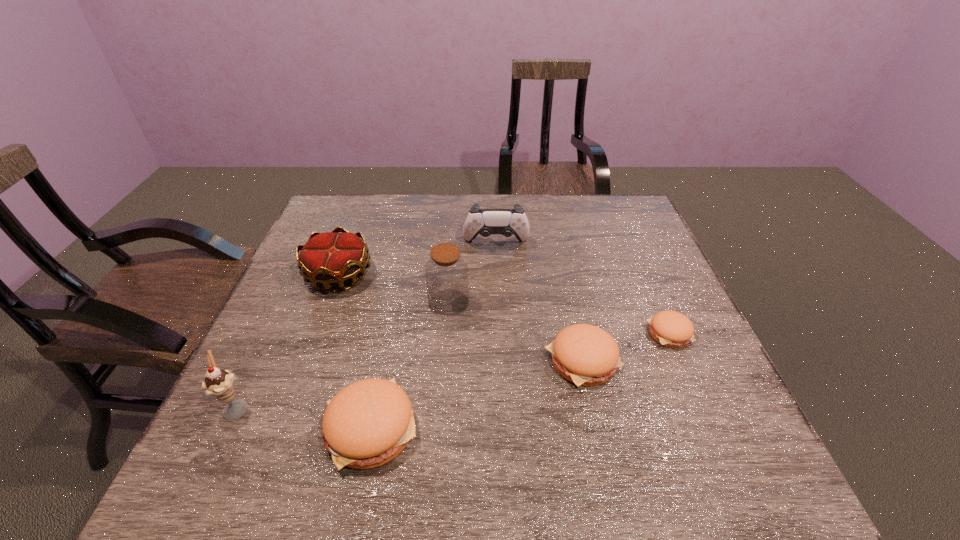
Locate an element on the screen. vacant space that is in between the second shortest patty and the fourth tallest object is located at coordinates (461, 318).

The image size is (960, 540). I want to click on free space between the rightmost object and the leftmost patty, so click(520, 381).

The height and width of the screenshot is (540, 960). Find the location of `free space between the jar and the second tallest patty`. free space between the jar and the second tallest patty is located at coordinates (516, 332).

You are a GUI agent. You are given a task and a screenshot of the screen. Output one action in this format:
    pyautogui.click(x=<x>, y=<y>)
    Task: Click on the free space between the leftmost patty and the rightmost object
    The image size is (960, 540).
    Given the screenshot: What is the action you would take?
    pyautogui.click(x=520, y=381)

Where is `free space between the jar and the icecream`? The height and width of the screenshot is (540, 960). free space between the jar and the icecream is located at coordinates (343, 355).

At what (x,y) coordinates should I click in order to perform the action: click on vacant space that's between the fifth shortest object and the crown. Please return your answer as a coordinate pair (x, y). Looking at the image, I should click on (418, 259).

The image size is (960, 540). I want to click on unoccupied area between the icecream and the rightmost object, so click(x=453, y=370).

The height and width of the screenshot is (540, 960). Find the location of `vacant space that is in between the shortest patty and the leftmost patty`. vacant space that is in between the shortest patty and the leftmost patty is located at coordinates (520, 381).

Where is `unoccupied position between the fourth tallest object and the icecream`? This screenshot has height=540, width=960. unoccupied position between the fourth tallest object and the icecream is located at coordinates (288, 341).

At what (x,y) coordinates should I click in order to perform the action: click on unoccupied area between the second patty from left to right and the shortest object. Please return your answer as a coordinate pair (x, y). The height and width of the screenshot is (540, 960). Looking at the image, I should click on (626, 347).